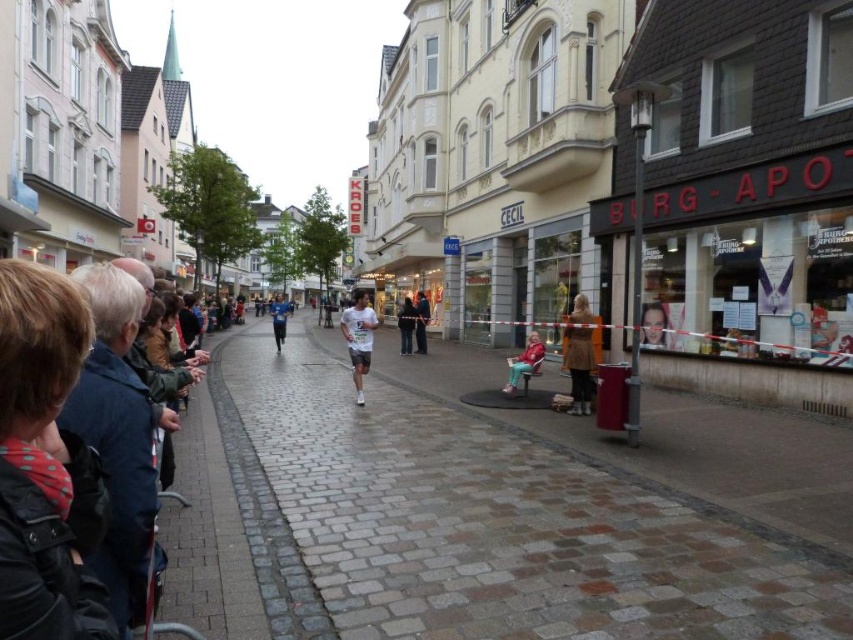
You are a photographer trying to capture a clear shot of both the matte pink coat at center and the matte black jacket at center from your position behind the crowd. Since the crowd is dense, you need to know which clothing item is narrower to decide which one you can frame first. Which clothing item is narrower?

The matte pink coat at center is thinner than the matte black jacket at center, so the matte pink coat at center is narrower and can be framed first.

You are a runner participating in a street race that starts at the brown cobblestone pavement at center and must reach the finish line at the matte brown storefront at right. Can you safely run straight from the starting point to the finish line without needing to go around any obstacles?

Yes, you can safely run straight from the brown cobblestone pavement at center to the matte brown storefront at right because the pavement is directly in front of the storefront, providing a clear path.